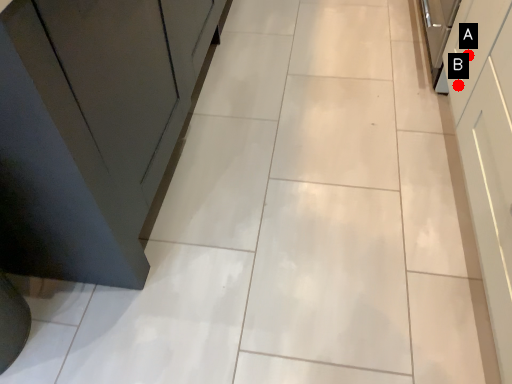
Question: Two points are circled on the image, labeled by A and B beside each circle. Among these points, which one is farthest from the camera?

Choices:
 (A) A is further
 (B) B is further

Answer: (B)